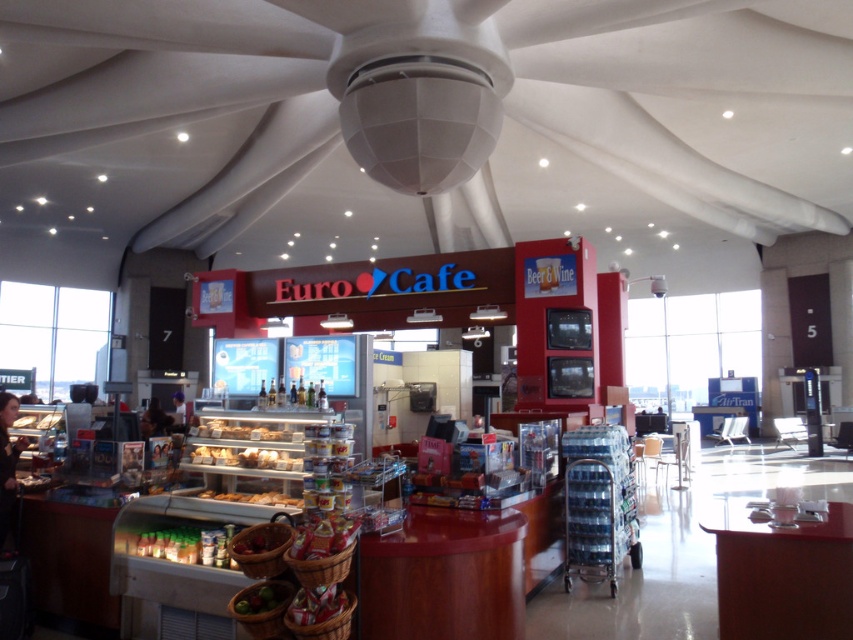
You are a customer at the Euro Cafe kiosk and want to place both the shiny red basket at center and the shiny red apples at center on the counter. The counter has limited space. Based on the description, which item should you place first to ensure both can fit?

The shiny red basket at center occupies less space than the shiny red apples at center, so you should place the shiny red apples at center first to make room for the smaller basket.

You are a customer at the Euro Cafe kiosk and want to place the shiny red apples at center into the shiny red basket at center. Can you fit them inside based on their sizes?

The shiny red basket at center has a greater height compared to shiny red apples at center, so yes, the apples can be placed inside the basket as the basket is taller than the apples.

You are a customer at the Euro Cafe kiosk. You want to place a shiny red basket at center into a storage compartment that is 15 inches wide. Will the basket fit if it is placed next to the shiny red apples at center?

The shiny red basket at center is 15.24 inches from shiny red apples at center. Since the storage compartment is 15 inches wide, the basket would not fit as it is slightly wider than the available space.